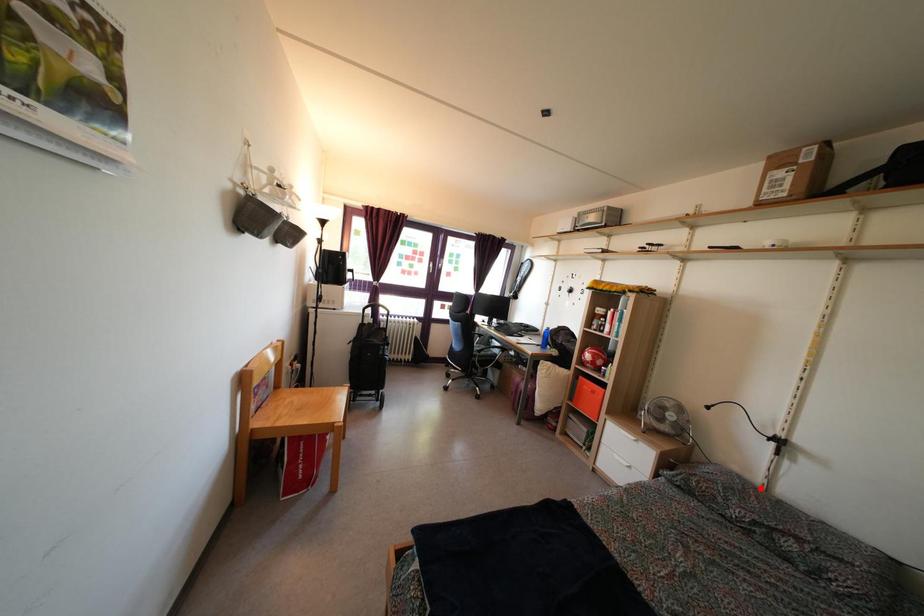
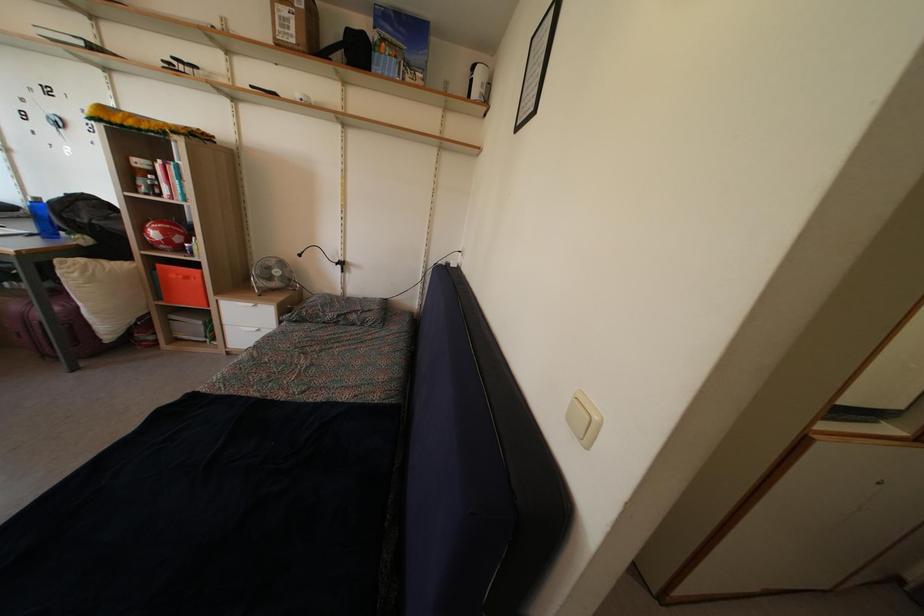
Find the pixel in the second image that matches the highlighted location in the first image.

(342, 301)